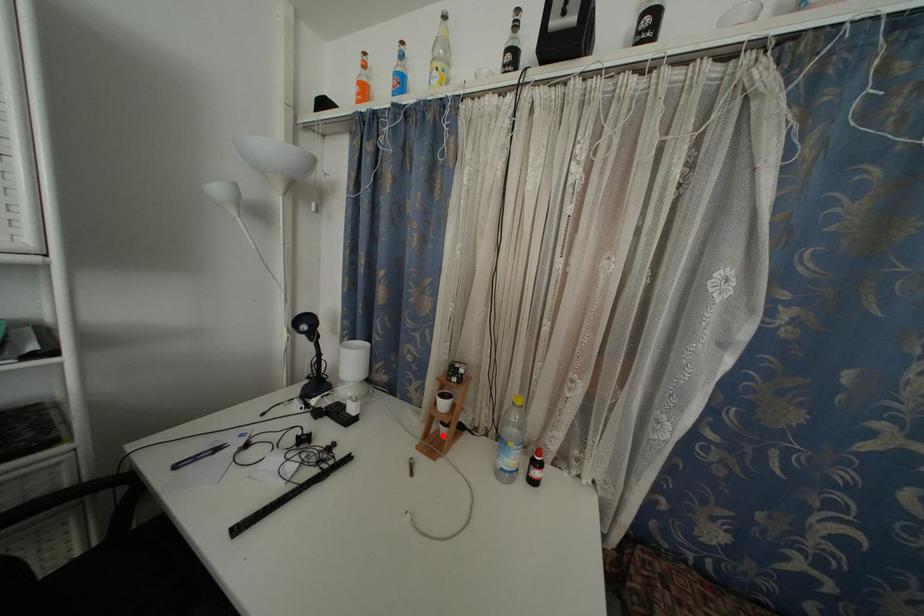
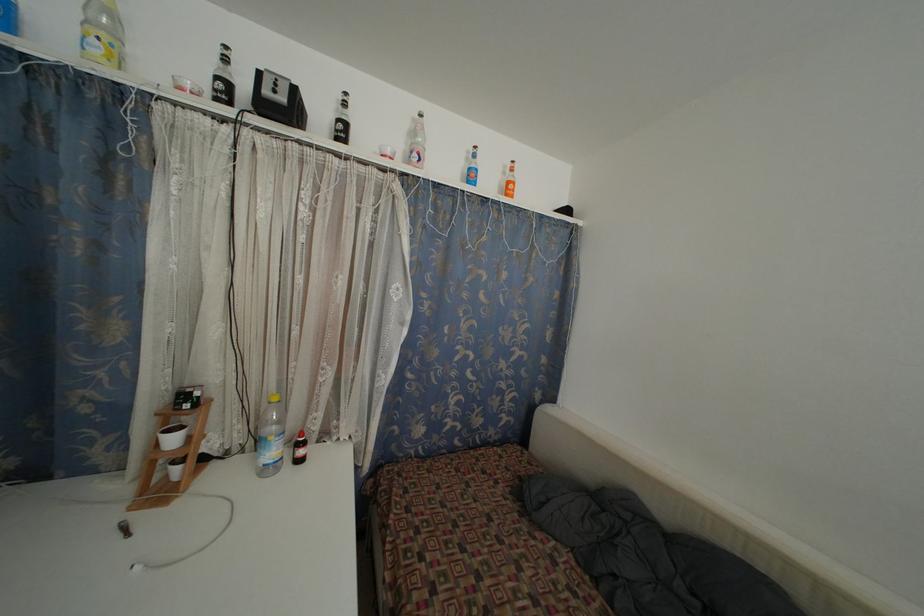
Question: I am providing you with two images of the same scene from different viewpoints. A red point is marked on the first image. Can you still see the location of the red point in image 2?

Choices:
 (A) Yes
 (B) No

Answer: (A)